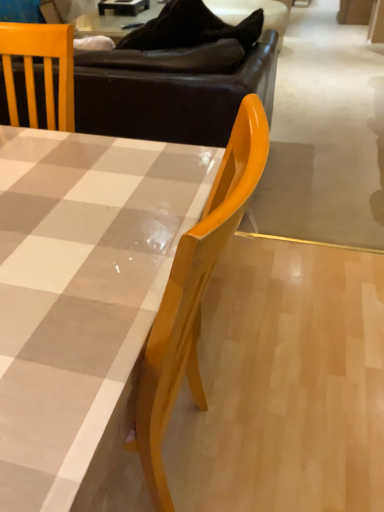
Question: Based on their positions, is matte checkered table at center located to the left or right of brown leather couch at upper center?

Choices:
 (A) left
 (B) right

Answer: (A)

Question: Relative to brown leather couch at upper center, is matte checkered table at center in front or behind?

Choices:
 (A) behind
 (B) front

Answer: (B)

Question: From their relative heights in the image, would you say matte checkered table at center is taller or shorter than brown leather couch at upper center?

Choices:
 (A) tall
 (B) short

Answer: (B)

Question: Is brown leather couch at upper center spatially inside matte checkered table at center, or outside of it?

Choices:
 (A) outside
 (B) inside

Answer: (A)

Question: Based on their sizes in the image, would you say brown leather couch at upper center is bigger or smaller than matte checkered table at center?

Choices:
 (A) small
 (B) big

Answer: (B)

Question: Relative to matte checkered table at center, is brown leather couch at upper center in front or behind?

Choices:
 (A) behind
 (B) front

Answer: (A)

Question: Is brown leather couch at upper center wider or thinner than matte checkered table at center?

Choices:
 (A) thin
 (B) wide

Answer: (B)